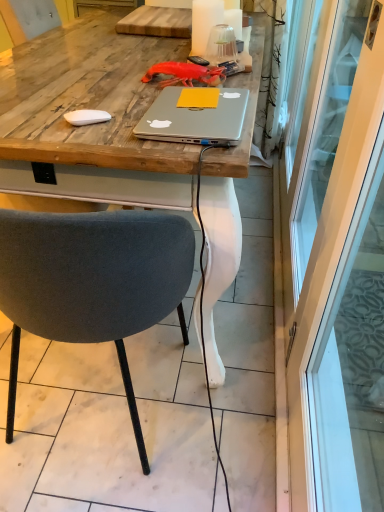
Question: Does silver metallic laptop at center appear on the left side of transparent glass screen door at right?

Choices:
 (A) no
 (B) yes

Answer: (B)

Question: Would you say silver metallic laptop at center is a long distance from transparent glass screen door at right?

Choices:
 (A) no
 (B) yes

Answer: (A)

Question: Does silver metallic laptop at center appear on the right side of transparent glass screen door at right?

Choices:
 (A) no
 (B) yes

Answer: (A)

Question: Is silver metallic laptop at center positioned before transparent glass screen door at right?

Choices:
 (A) no
 (B) yes

Answer: (A)

Question: Are silver metallic laptop at center and transparent glass screen door at right beside each other?

Choices:
 (A) yes
 (B) no

Answer: (B)

Question: Is silver metallic laptop at center in front of or behind transparent glass screen door at right in the image?

Choices:
 (A) behind
 (B) front

Answer: (A)

Question: In terms of height, does silver metallic laptop at center look taller or shorter compared to transparent glass screen door at right?

Choices:
 (A) tall
 (B) short

Answer: (B)

Question: Considering the positions of silver metallic laptop at center and transparent glass screen door at right in the image, is silver metallic laptop at center bigger or smaller than transparent glass screen door at right?

Choices:
 (A) big
 (B) small

Answer: (B)

Question: From the image's perspective, is silver metallic laptop at center positioned above or below transparent glass screen door at right?

Choices:
 (A) above
 (B) below

Answer: (B)

Question: Visually, is velvet grey chair at center positioned to the left or to the right of transparent glass screen door at right?

Choices:
 (A) left
 (B) right

Answer: (A)

Question: Looking at the image, does velvet grey chair at center seem bigger or smaller compared to transparent glass screen door at right?

Choices:
 (A) big
 (B) small

Answer: (A)

Question: Which is correct: velvet grey chair at center is inside transparent glass screen door at right, or outside of it?

Choices:
 (A) inside
 (B) outside

Answer: (B)

Question: From the image's perspective, relative to transparent glass screen door at right, is velvet grey chair at center above or below?

Choices:
 (A) below
 (B) above

Answer: (A)

Question: Is transparent glass screen door at right situated inside velvet grey chair at center or outside?

Choices:
 (A) outside
 (B) inside

Answer: (A)

Question: Is transparent glass screen door at right wider or thinner than velvet grey chair at center?

Choices:
 (A) wide
 (B) thin

Answer: (B)